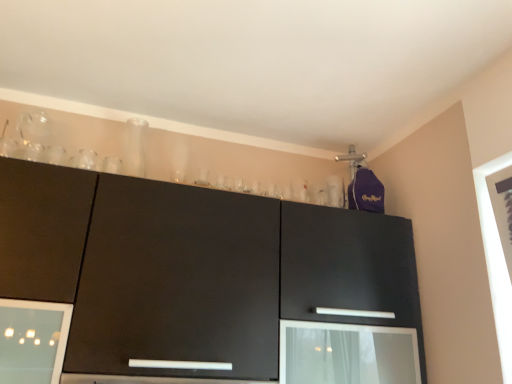
Question: Considering the relative positions of matte black cabinet at upper center and transparent glass screen door at lower center in the image provided, is matte black cabinet at upper center to the left or to the right of transparent glass screen door at lower center?

Choices:
 (A) right
 (B) left

Answer: (B)

Question: Considering their positions, is matte black cabinet at upper center located in front of or behind transparent glass screen door at lower center?

Choices:
 (A) behind
 (B) front

Answer: (B)

Question: From the image's perspective, is matte black cabinet at upper center positioned above or below transparent glass screen door at lower center?

Choices:
 (A) above
 (B) below

Answer: (A)

Question: Based on their positions, is transparent glass screen door at lower center located to the left or right of matte black cabinet at upper center?

Choices:
 (A) left
 (B) right

Answer: (B)

Question: From the image's perspective, relative to matte black cabinet at upper center, is transparent glass screen door at lower center above or below?

Choices:
 (A) above
 (B) below

Answer: (B)

Question: Considering the positions of transparent glass screen door at lower center and matte black cabinet at upper center in the image, is transparent glass screen door at lower center bigger or smaller than matte black cabinet at upper center?

Choices:
 (A) small
 (B) big

Answer: (A)

Question: In terms of width, does transparent glass screen door at lower center look wider or thinner when compared to matte black cabinet at upper center?

Choices:
 (A) thin
 (B) wide

Answer: (A)